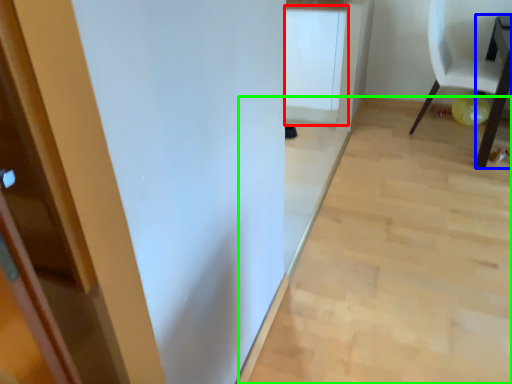
Question: Based on their relative distances, which object is farther from cabinetry (highlighted by a red box)? Choose from table (highlighted by a blue box) and plain (highlighted by a green box).

Choices:
 (A) table
 (B) plain

Answer: (A)